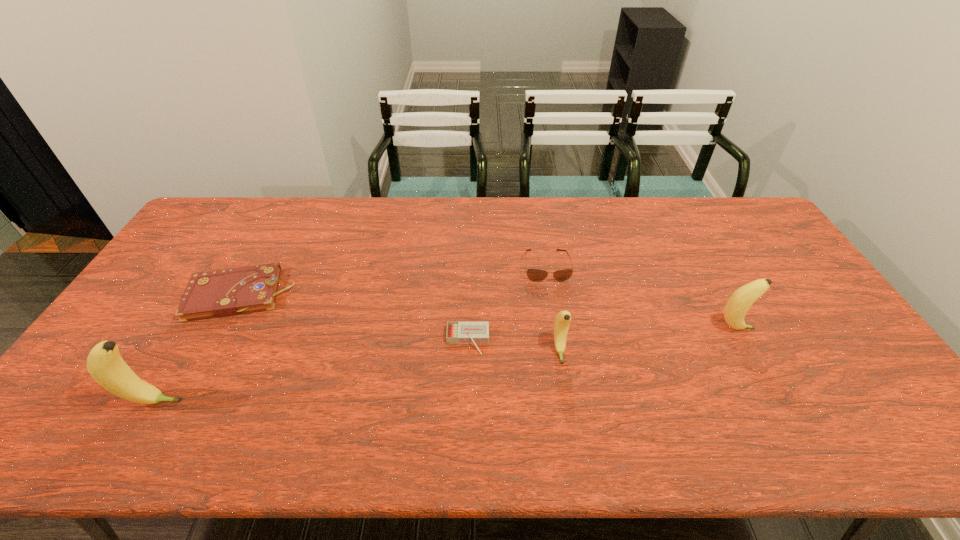
Please determine a free point for an extra banana to ensure balance. Please provide its 2D coordinates. Your answer should be formatted as a tuple, i.e. [(x, y)], where the tuple contains the x and y coordinates of a point satisfying the conditions above.

[(367, 375)]